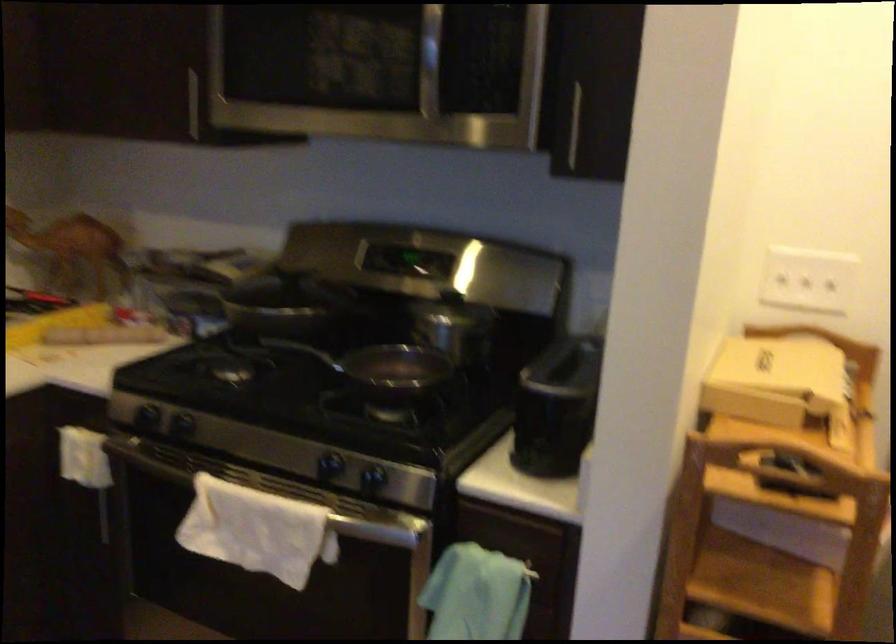
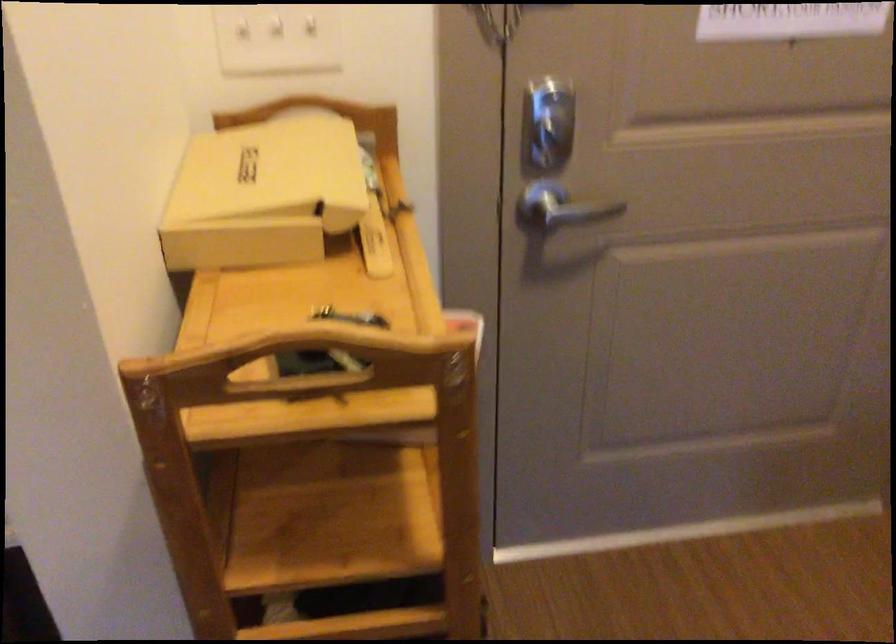
The point at (779, 467) is marked in the first image. Where is the corresponding point in the second image?

(300, 364)